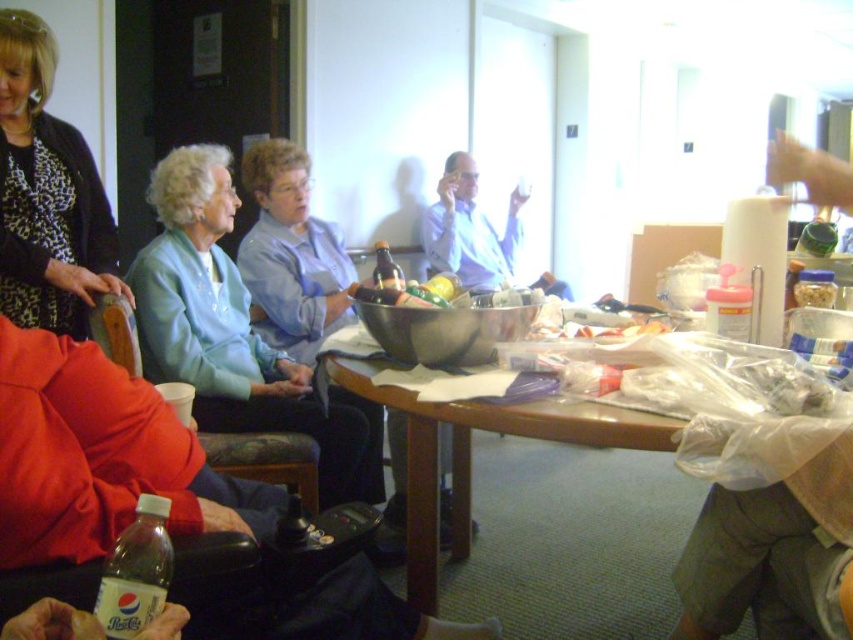
You are standing at the entrance of the room and want to reach the brown glossy table at center without walking through the area where the light blue fabric jacket at upper left is located. Is this possible?

Yes, since the light blue fabric jacket at upper left is to the left of the brown glossy table at center, you can walk around the right side of the jacket or go behind it to reach the table without passing through its location.

You are standing in the room and want to reach the brown glossy table at center. There is a leopard print fabric at upper left in your way. Can you walk around it to get to the table?

The leopard print fabric at upper left is further to the viewer than the brown glossy table at center, so the leopard print fabric at upper left is closer to you. You can walk around it to reach the brown glossy table at center.